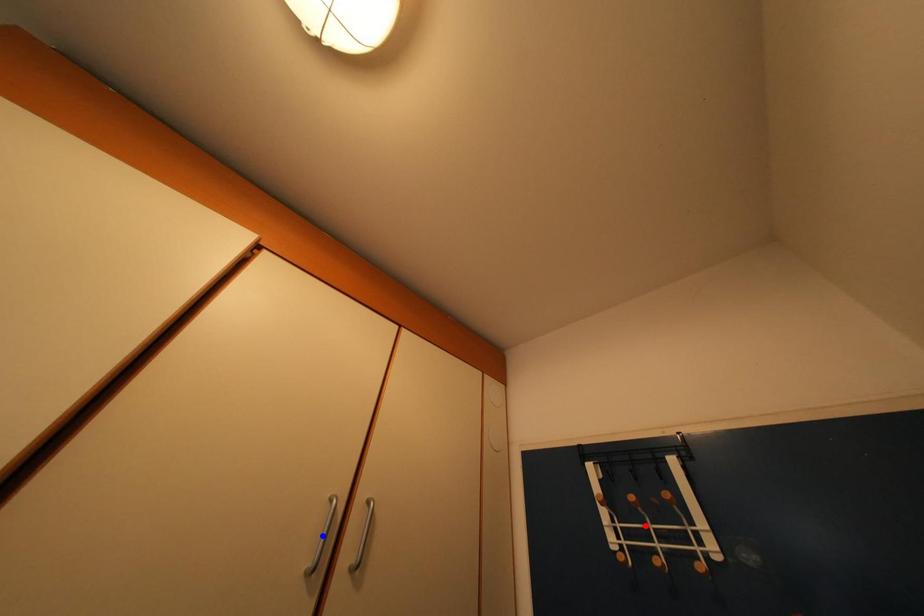
Question: In the image, two points are highlighted. Which point is nearer to the camera? Reply with the corresponding letter.

Choices:
 (A) blue point
 (B) red point

Answer: (A)